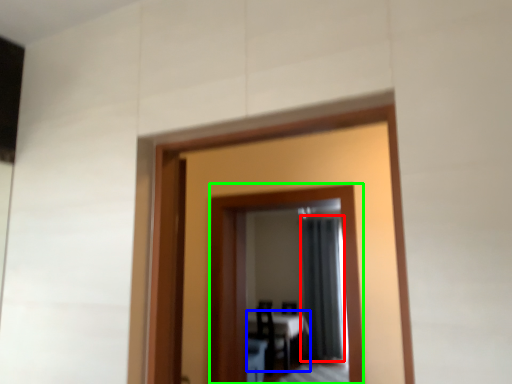
Question: Estimate the real-world distances between objects in this image. Which object is farther from curtain (highlighted by a red box), table (highlighted by a blue box) or mirror (highlighted by a green box)?

Choices:
 (A) table
 (B) mirror

Answer: (B)